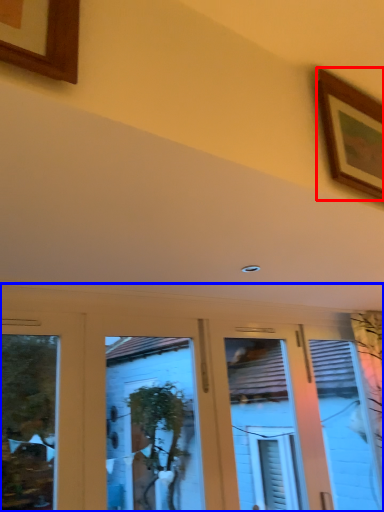
Question: Which point is further to the camera, picture frame (highlighted by a red box) or hotel lobby (highlighted by a blue box)?

Choices:
 (A) picture frame
 (B) hotel lobby

Answer: (B)